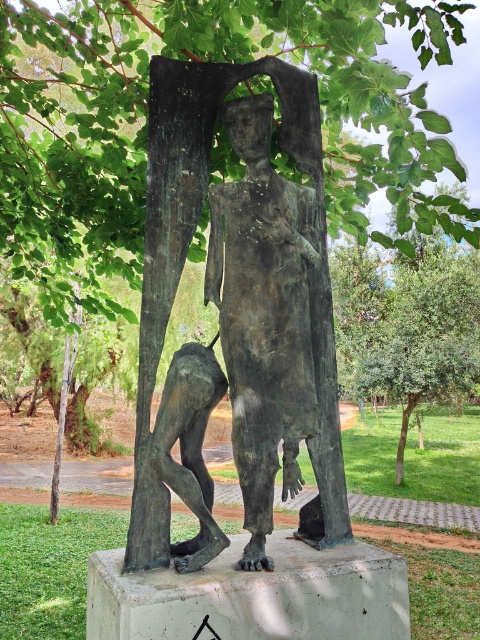
Question: Which object appears farthest from the camera in this image?

Choices:
 (A) bronze statue at center
 (B) bronze sculpture at lower left

Answer: (A)

Question: Can you confirm if bronze statue at center is smaller than bronze sculpture at lower left?

Choices:
 (A) no
 (B) yes

Answer: (A)

Question: Considering the relative positions of bronze statue at center and bronze sculpture at lower left in the image provided, where is bronze statue at center located with respect to bronze sculpture at lower left?

Choices:
 (A) below
 (B) above

Answer: (B)

Question: Is bronze statue at center to the right of bronze sculpture at lower left from the viewer's perspective?

Choices:
 (A) no
 (B) yes

Answer: (B)